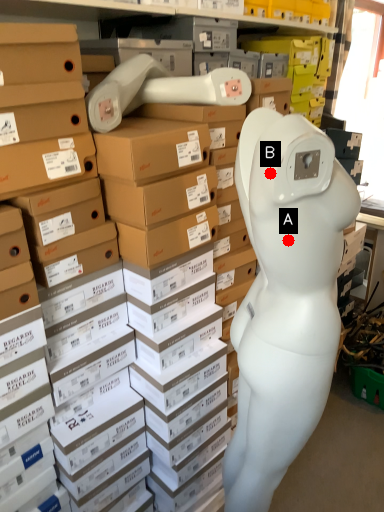
Question: Two points are circled on the image, labeled by A and B beside each circle. Which point appears closest to the camera in this image?

Choices:
 (A) A is closer
 (B) B is closer

Answer: (B)